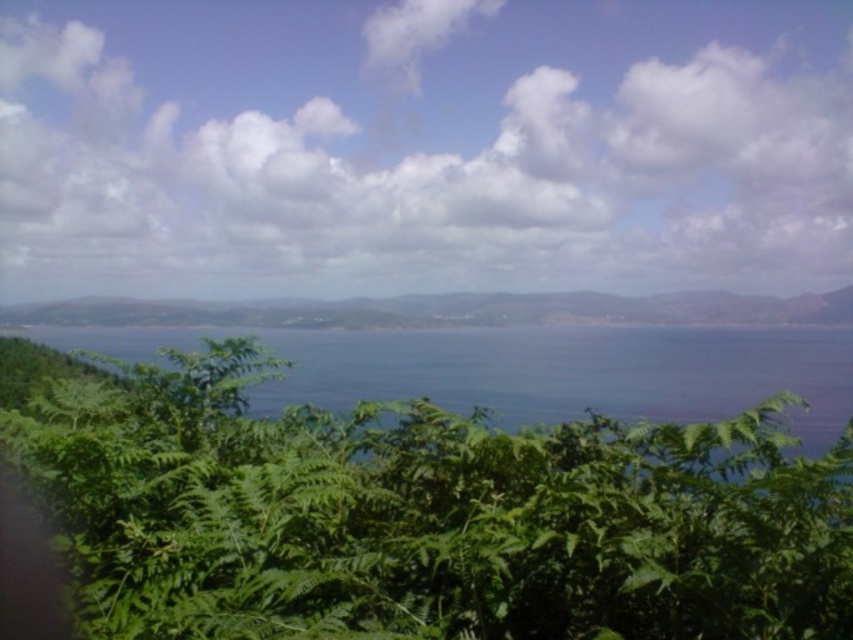
Question: Can you confirm if white fluffy cloud at upper center is positioned to the right of green leafy plant at center?

Choices:
 (A) yes
 (B) no

Answer: (A)

Question: Is blue liquid water at center smaller than green leafy vegetation at center?

Choices:
 (A) no
 (B) yes

Answer: (A)

Question: Which object is the closest to the green leafy plant at center?

Choices:
 (A) blue liquid water at center
 (B) green leafy vegetation at center
 (C) white fluffy cloud at upper center

Answer: (A)

Question: Which of the following is the closest to the observer?

Choices:
 (A) green leafy vegetation at center
 (B) blue liquid water at center

Answer: (B)

Question: Which object is positioned farthest from the green leafy vegetation at center?

Choices:
 (A) white fluffy cloud at upper center
 (B) green leafy plant at center

Answer: (B)

Question: Does blue liquid water at center appear on the left side of green leafy vegetation at center?

Choices:
 (A) no
 (B) yes

Answer: (B)